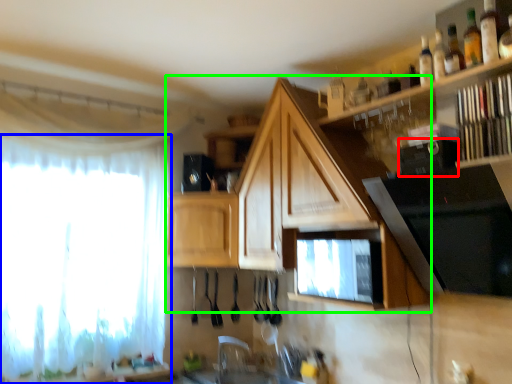
Question: Which is nearer to the appliance (highlighted by a red box)? curtain (highlighted by a blue box) or cabinetry (highlighted by a green box).

Choices:
 (A) curtain
 (B) cabinetry

Answer: (B)